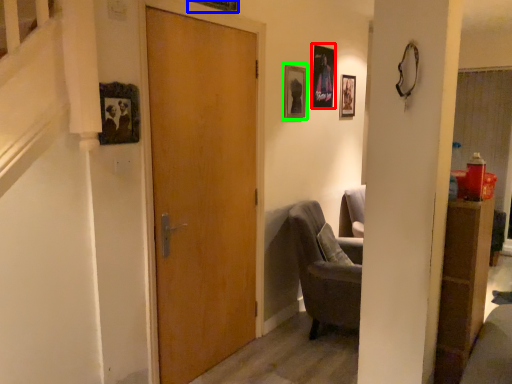
Question: Which object is positioned closest to picture frame (highlighted by a red box)? Select from picture frame (highlighted by a blue box) and picture frame (highlighted by a green box).

Choices:
 (A) picture frame
 (B) picture frame

Answer: (B)